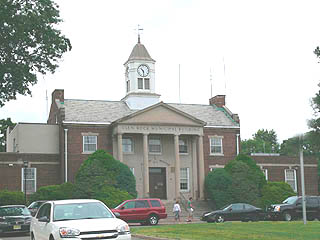
The image size is (320, 240). Find the location of `clock`. clock is located at coordinates (143, 71).